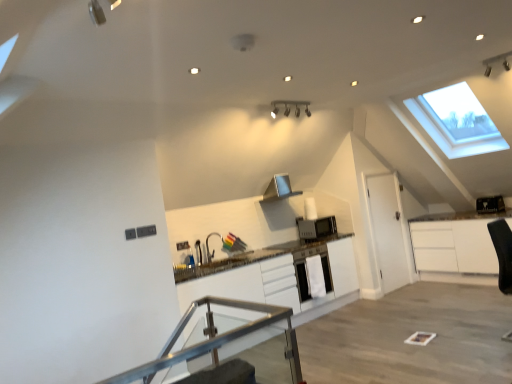
Question: Is satin silver microwave at center, which is the second appliance from top to bottom, taller than silver metallic exhaust hood at center?

Choices:
 (A) yes
 (B) no

Answer: (B)

Question: Could you tell me if satin silver microwave at center, the 2th appliance viewed from the right, is facing silver metallic exhaust hood at center?

Choices:
 (A) yes
 (B) no

Answer: (B)

Question: Can you see satin silver microwave at center, placed as the 1th appliance when sorted from bottom to top, touching silver metallic exhaust hood at center?

Choices:
 (A) yes
 (B) no

Answer: (B)

Question: Can you confirm if satin silver microwave at center, which is the second appliance from top to bottom, is positioned to the left of silver metallic exhaust hood at center?

Choices:
 (A) yes
 (B) no

Answer: (B)

Question: From the image's perspective, is satin silver microwave at center, placed as the 1th appliance when sorted from bottom to top, above silver metallic exhaust hood at center?

Choices:
 (A) yes
 (B) no

Answer: (B)

Question: Relative to white matte cabinet at center, is satin silver microwave at center, the 2th appliance viewed from the right, in front or behind?

Choices:
 (A) front
 (B) behind

Answer: (B)

Question: Is satin silver microwave at center, placed as the 1th appliance when sorted from bottom to top, to the left or to the right of white matte cabinet at center in the image?

Choices:
 (A) left
 (B) right

Answer: (B)

Question: Considering the positions of satin silver microwave at center, placed as the 1th appliance when sorted from bottom to top, and white matte cabinet at center in the image, is satin silver microwave at center, placed as the 1th appliance when sorted from bottom to top, bigger or smaller than white matte cabinet at center?

Choices:
 (A) big
 (B) small

Answer: (B)

Question: Is point (307, 225) positioned closer to the camera than point (322, 246)?

Choices:
 (A) closer
 (B) farther

Answer: (B)

Question: From a real-world perspective, is transparent glass table at center positioned above or below black plastic toaster at upper right, which appears as the 1th appliance when viewed from the top?

Choices:
 (A) above
 (B) below

Answer: (B)

Question: From the image's perspective, relative to black plastic toaster at upper right, arranged as the first appliance when viewed from the right, is transparent glass table at center above or below?

Choices:
 (A) below
 (B) above

Answer: (A)

Question: Is transparent glass table at center inside the boundaries of black plastic toaster at upper right, acting as the 2th appliance starting from the bottom, or outside?

Choices:
 (A) outside
 (B) inside

Answer: (A)

Question: Is point (174, 329) closer or farther from the camera than point (501, 200)?

Choices:
 (A) farther
 (B) closer

Answer: (B)

Question: Is point (489, 205) closer or farther from the camera than point (393, 283)?

Choices:
 (A) farther
 (B) closer

Answer: (A)

Question: From a real-world perspective, relative to white matte door at right, is black plastic toaster at upper right, which appears as the 1th appliance when viewed from the top, vertically above or below?

Choices:
 (A) below
 (B) above

Answer: (B)